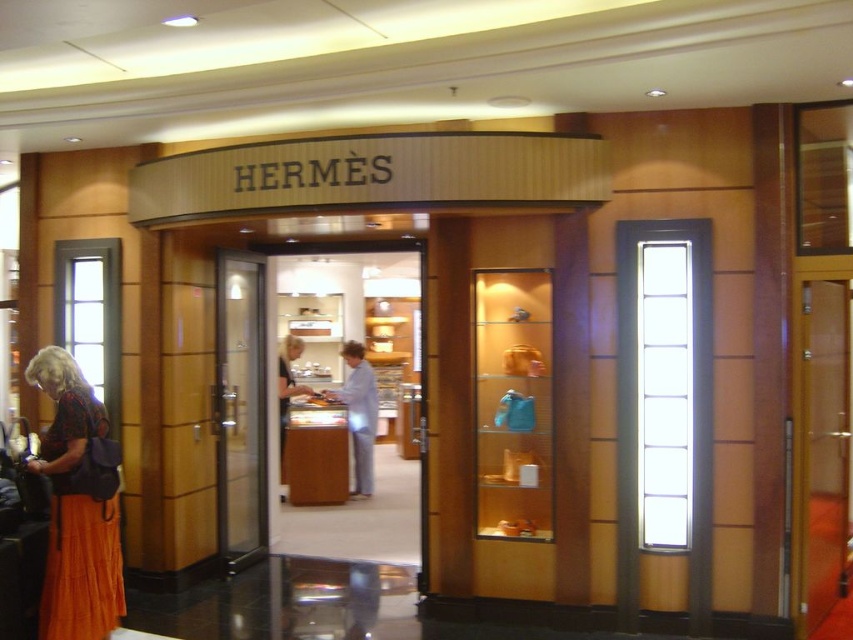
You are a customer standing at the entrance of the Hermes store. You see a light blue fabric shirt at center and a light beige fabric jacket at center. Which item is positioned lower on the display rack?

The light blue fabric shirt at center is positioned below the light beige fabric jacket at center, so it is lower on the display rack.

You are standing at the entrance of the Hermes store and want to enter through the transparent glass door at center. If you are currently 5 meters away from the door, how many more meters do you need to walk forward to reach it?

You need to walk 0.51 meters more to reach the transparent glass door at center because the distance between it and the camera is 5.51 meters, and you are currently 5 meters away.

You are standing at the entrance of the Hermes store and see the orange skirt at lower left. Where exactly is the orange skirt located in terms of coordinates?

The orange skirt at lower left is located at point (77, 506).